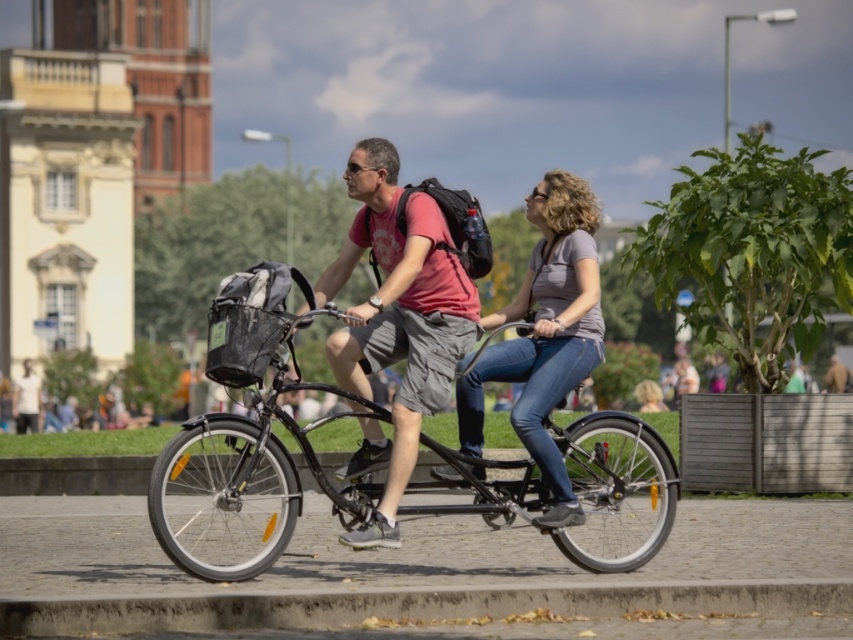
You are standing at the origin point of the coordinate system. The shiny black bicycle at center is located at point 0.759, 0.287. If you want to move towards the bicycle, in which direction should you go?

The shiny black bicycle at center is located at point (244, 484), so you should move towards the positive x and positive y direction to reach it.